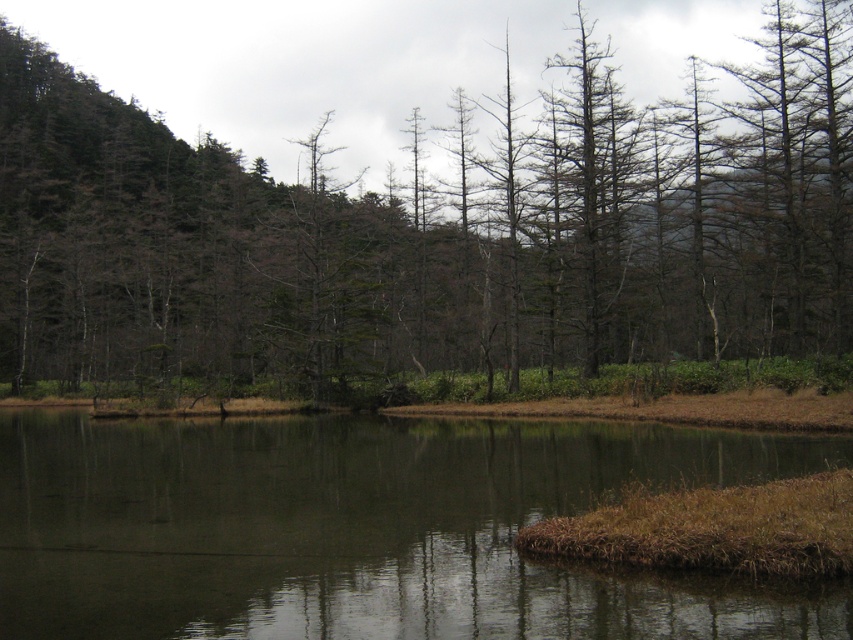
You are standing at the edge of the water in the scene and want to reach the brown matte tree at center. Which direction should you move to get closer to it without crossing the dark reflective water at center?

You should move towards the brown matte tree at center by going around the dark reflective water at center since the brown matte tree at center is closer to you than the water, meaning the water is behind the tree in this perspective.

You are standing at the point marked by point (430, 236) in the image. Looking around, what do you see directly in front of you?

You see a brown matte tree at center directly in front of you at the marked point.